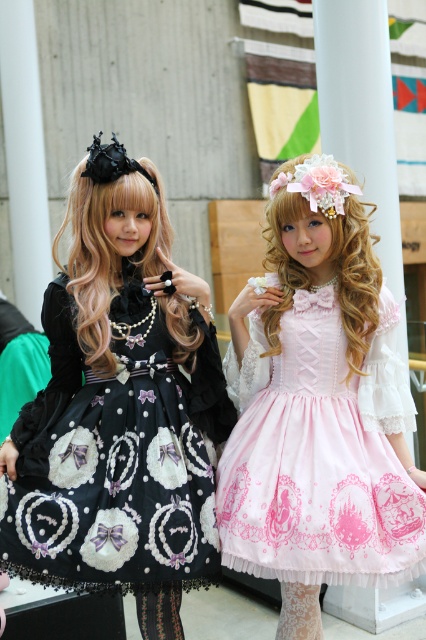
Can you confirm if black lace dress at left is smaller than pink satin dress at center?

Indeed, black lace dress at left has a smaller size compared to pink satin dress at center.

Does black lace dress at left lie in front of pink satin dress at center?

That is False.

Where is `black lace dress at left`? This screenshot has width=426, height=640. black lace dress at left is located at coordinates (117, 458).

Measure the distance from black lace dress at left to lace fabric skirt at center.

The distance of black lace dress at left from lace fabric skirt at center is 26.02 inches.

Which of these two, black lace dress at left or lace fabric skirt at center, stands shorter?

lace fabric skirt at center

Does point (190, 497) come closer to viewer compared to point (291, 618)?

Yes, point (190, 497) is in front of point (291, 618).

Image resolution: width=426 pixels, height=640 pixels. In order to click on black lace dress at left in this screenshot , I will do `click(117, 458)`.

What do you see at coordinates (319, 454) in the screenshot?
I see `pink satin dress at center` at bounding box center [319, 454].

Which is more to the left, pink satin dress at center or lace fabric skirt at center?

lace fabric skirt at center is more to the left.

At what (x,y) coordinates should I click in order to perform the action: click on pink satin dress at center. Please return your answer as a coordinate pair (x, y). The width and height of the screenshot is (426, 640). Looking at the image, I should click on (319, 454).